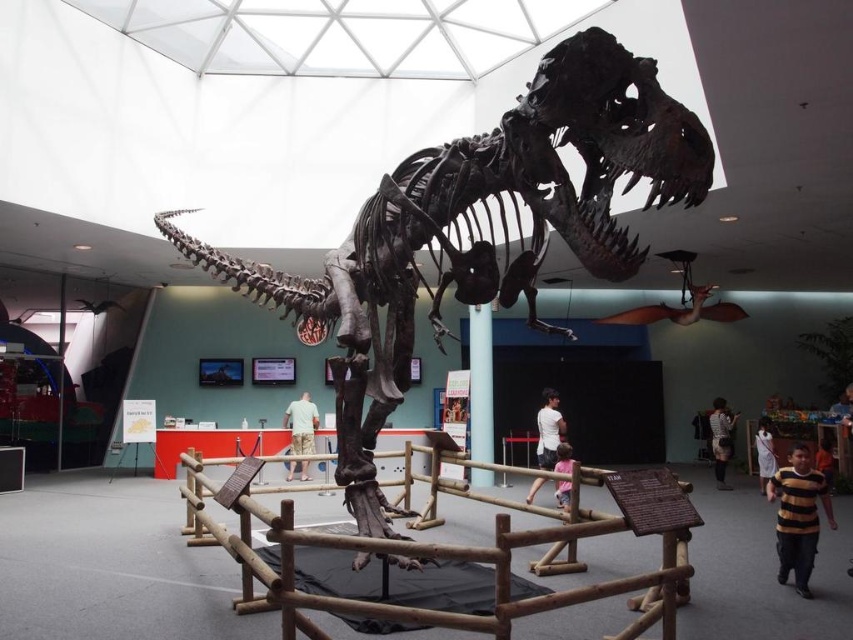
Between yellow striped sweater at lower right and white cotton dress at lower right, which one appears on the left side from the viewer's perspective?

yellow striped sweater at lower right

Is yellow striped sweater at lower right shorter than white cotton dress at lower right?

In fact, yellow striped sweater at lower right may be taller than white cotton dress at lower right.

Image resolution: width=853 pixels, height=640 pixels. What do you see at coordinates (798, 516) in the screenshot? I see `yellow striped sweater at lower right` at bounding box center [798, 516].

I want to click on yellow striped sweater at lower right, so click(x=798, y=516).

From the picture: Does blue glossy pillar at center have a lesser width compared to white cotton dress at lower right?

Yes.

Can you confirm if blue glossy pillar at center is shorter than white cotton dress at lower right?

No.

Which is behind, point (476, 483) or point (764, 492)?

The point (476, 483) is more distant.

The height and width of the screenshot is (640, 853). Identify the location of blue glossy pillar at center. (480, 381).

Does striped shirt at lower right appear on the right side of white cotton dress at lower right?

In fact, striped shirt at lower right is to the left of white cotton dress at lower right.

Is point (724, 438) more distant than point (775, 468)?

Yes.

Is point (717, 396) farther from viewer compared to point (762, 464)?

Yes, point (717, 396) is behind point (762, 464).

Identify the location of striped shirt at lower right. The width and height of the screenshot is (853, 640). (720, 440).